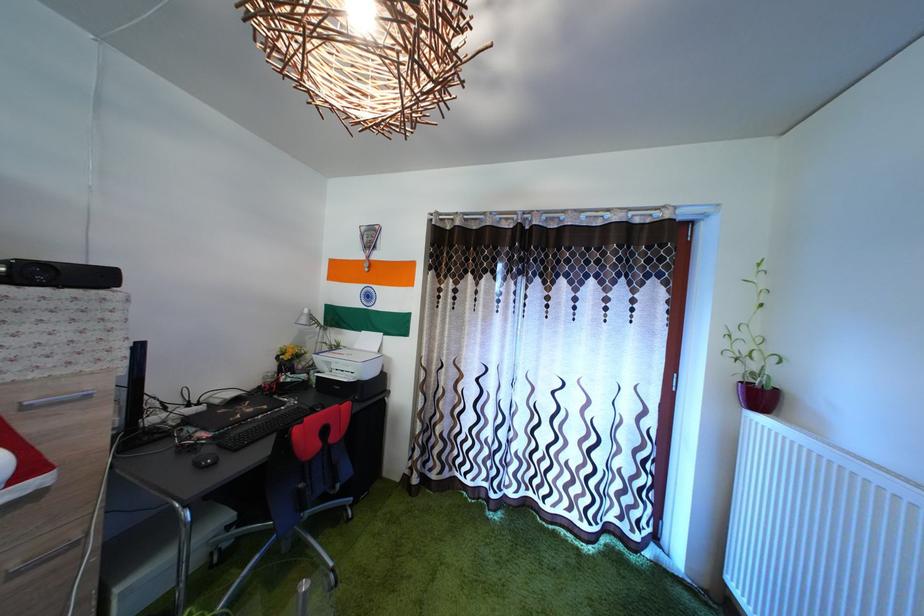
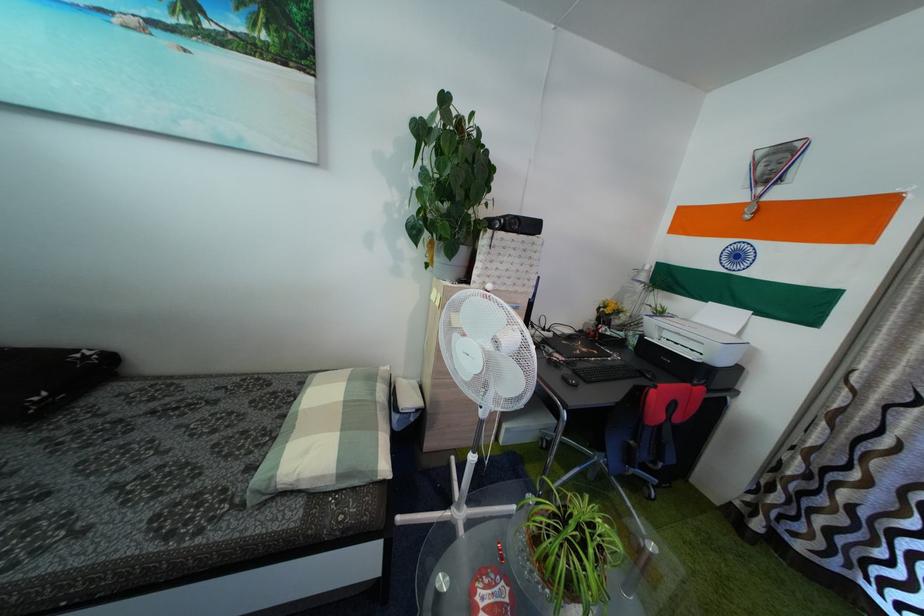
Question: How did the camera likely rotate?

Choices:
 (A) Left
 (B) Right
 (C) Up
 (D) Down

Answer: (A)